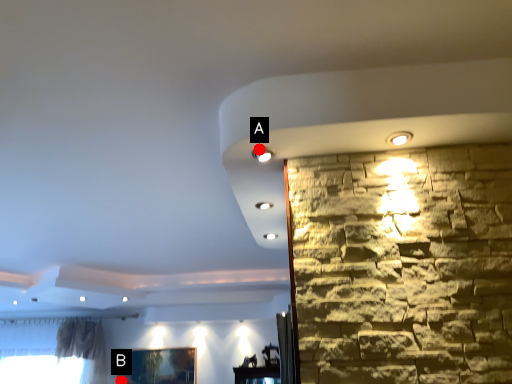
Question: Two points are circled on the image, labeled by A and B beside each circle. Which point is closer to the camera?

Choices:
 (A) A is closer
 (B) B is closer

Answer: (A)